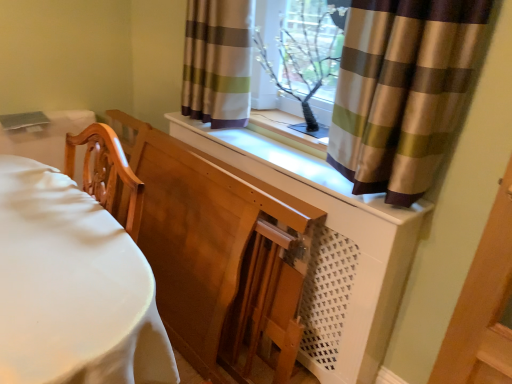
The width and height of the screenshot is (512, 384). What do you see at coordinates (404, 91) in the screenshot?
I see `brown striped curtain at upper center, the second curtain viewed from the back` at bounding box center [404, 91].

This screenshot has height=384, width=512. What do you see at coordinates (217, 62) in the screenshot?
I see `striped fabric curtain at upper center, which is counted as the 2th curtain, starting from the right` at bounding box center [217, 62].

Where is `clear glass window frame at upper center`? Image resolution: width=512 pixels, height=384 pixels. clear glass window frame at upper center is located at coordinates (306, 52).

Considering the relative sizes of clear glass window frame at upper center and brown striped curtain at upper center, which is the 1th curtain from right to left, in the image provided, is clear glass window frame at upper center shorter than brown striped curtain at upper center, which is the 1th curtain from right to left,?

Correct, clear glass window frame at upper center is not as tall as brown striped curtain at upper center, which is the 1th curtain from right to left.

Is there a large distance between clear glass window frame at upper center and brown striped curtain at upper center, the first curtain positioned from the front?

clear glass window frame at upper center is actually quite close to brown striped curtain at upper center, the first curtain positioned from the front.

Is point (289, 39) closer or farther from the camera than point (408, 106)?

Point (289, 39) is positioned farther from the camera compared to point (408, 106).

In the scene shown: Considering the relative sizes of clear glass window frame at upper center and brown striped curtain at upper center, which ranks as the second curtain in left-to-right order, in the image provided, is clear glass window frame at upper center thinner than brown striped curtain at upper center, which ranks as the second curtain in left-to-right order,?

Yes.

Considering the relative sizes of brown striped curtain at upper center, the first curtain positioned from the front, and wooden chair at left in the image provided, is brown striped curtain at upper center, the first curtain positioned from the front, taller than wooden chair at left?

No.

Which is in front, brown striped curtain at upper center, which is the 1th curtain from right to left, or wooden chair at left?

wooden chair at left is more forward.

In order to click on furniture below the brown striped curtain at upper center, the second curtain viewed from the back (from the image's perspective) in this screenshot , I will do `click(72, 287)`.

From a real-world perspective, between striped fabric curtain at upper center, placed as the 1th curtain when sorted from back to front, and brown striped curtain at upper center, the second curtain viewed from the back, who is vertically lower?

From a 3D spatial view, striped fabric curtain at upper center, placed as the 1th curtain when sorted from back to front, is below.

Is point (249, 19) positioned after point (391, 204)?

Yes, point (249, 19) is behind point (391, 204).

Considering the positions of objects striped fabric curtain at upper center, which is counted as the 2th curtain, starting from the right, and brown striped curtain at upper center, the first curtain positioned from the front, in the image provided, who is in front, striped fabric curtain at upper center, which is counted as the 2th curtain, starting from the right, or brown striped curtain at upper center, the first curtain positioned from the front,?

brown striped curtain at upper center, the first curtain positioned from the front, is in front.

In the image, is striped fabric curtain at upper center, placed as the 1th curtain when sorted from back to front, on the left side or the right side of brown striped curtain at upper center, which ranks as the second curtain in left-to-right order?

Clearly, striped fabric curtain at upper center, placed as the 1th curtain when sorted from back to front, is on the left of brown striped curtain at upper center, which ranks as the second curtain in left-to-right order, in the image.

Is wooden chair at left not close to brown striped curtain at upper center, which is the 1th curtain from right to left?

wooden chair at left is actually quite close to brown striped curtain at upper center, which is the 1th curtain from right to left.

Which object is thinner, wooden chair at left or brown striped curtain at upper center, the first curtain positioned from the front?

brown striped curtain at upper center, the first curtain positioned from the front, is thinner.

Is brown striped curtain at upper center, the second curtain viewed from the back, a part of wooden chair at left?

Definitely not — brown striped curtain at upper center, the second curtain viewed from the back, is not inside wooden chair at left.

Which object is positioned more to the left, wooden chair at left or brown striped curtain at upper center, the second curtain viewed from the back?

From the viewer's perspective, wooden chair at left appears more on the left side.

Which of these two, wooden chair at left or clear glass window frame at upper center, is wider?

With larger width is wooden chair at left.

In the image, is wooden chair at left on the left side or the right side of clear glass window frame at upper center?

wooden chair at left is to the left of clear glass window frame at upper center.

Consider the image. Between wooden chair at left and clear glass window frame at upper center, which one has larger size?

Answer: With larger size is wooden chair at left.

In the scene shown: Could you tell me if wooden chair at left is turned towards clear glass window frame at upper center?

No, wooden chair at left does not turn towards clear glass window frame at upper center.

Does clear glass window frame at upper center have a greater width compared to wooden chair at left?

No.

Which is in front, clear glass window frame at upper center or wooden chair at left?

wooden chair at left is in front.

Considering the relative positions of clear glass window frame at upper center and wooden chair at left in the image provided, is clear glass window frame at upper center to the left of wooden chair at left from the viewer's perspective?

No.

In the scene shown: How distant is clear glass window frame at upper center from wooden chair at left?

clear glass window frame at upper center and wooden chair at left are 3.38 feet apart from each other.

Is point (201, 1) behind point (320, 268)?

Yes.

Is striped fabric curtain at upper center, which is counted as the 2th curtain, starting from the right, positioned in front of white matte dresser at center?

No, striped fabric curtain at upper center, which is counted as the 2th curtain, starting from the right, is further to the viewer.

Between striped fabric curtain at upper center, the first curtain positioned from the left, and white matte dresser at center, which one has larger width?

With larger width is white matte dresser at center.

Considering the relative sizes of striped fabric curtain at upper center, the first curtain positioned from the left, and white matte dresser at center in the image provided, is striped fabric curtain at upper center, the first curtain positioned from the left, bigger than white matte dresser at center?

No, striped fabric curtain at upper center, the first curtain positioned from the left, is not bigger than white matte dresser at center.

Image resolution: width=512 pixels, height=384 pixels. In order to click on curtain that is on the right side of clear glass window frame at upper center in this screenshot , I will do `click(404, 91)`.

Identify the location of curtain that is the 1st object located above the wooden chair at left (from the image's perspective). The height and width of the screenshot is (384, 512). (404, 91).

From the picture: When comparing their distances from white matte dresser at center, does brown striped curtain at upper center, the first curtain positioned from the front, or striped fabric curtain at upper center, the first curtain positioned from the left, seem further?

striped fabric curtain at upper center, the first curtain positioned from the left, lies further to white matte dresser at center than the other object.

From the image, which object appears to be nearer to wooden chair at left, white matte dresser at center or brown striped curtain at upper center, which ranks as the second curtain in left-to-right order?

white matte dresser at center is closer to wooden chair at left.

Based on their spatial positions, is brown striped curtain at upper center, which ranks as the second curtain in left-to-right order, or striped fabric curtain at upper center, arranged as the 2th curtain when viewed from the front, closer to wooden chair at left?

The object closer to wooden chair at left is striped fabric curtain at upper center, arranged as the 2th curtain when viewed from the front.

Based on their spatial positions, is white matte dresser at center or wooden chair at left further from brown striped curtain at upper center, the first curtain positioned from the front?

wooden chair at left.

Looking at this image, considering their positions, is wooden chair at left positioned closer to white matte dresser at center than brown striped curtain at upper center, the second curtain viewed from the back?

The object closer to white matte dresser at center is brown striped curtain at upper center, the second curtain viewed from the back.

When comparing their distances from brown striped curtain at upper center, which is the 1th curtain from right to left, does striped fabric curtain at upper center, placed as the 1th curtain when sorted from back to front, or wooden chair at left seem closer?

Based on the image, striped fabric curtain at upper center, placed as the 1th curtain when sorted from back to front, appears to be nearer to brown striped curtain at upper center, which is the 1th curtain from right to left.

Estimate the real-world distances between objects in this image. Which object is further from striped fabric curtain at upper center, placed as the 1th curtain when sorted from back to front, white matte dresser at center or brown striped curtain at upper center, the first curtain positioned from the front?

brown striped curtain at upper center, the first curtain positioned from the front, is positioned further to the anchor striped fabric curtain at upper center, placed as the 1th curtain when sorted from back to front.

From the image, which object appears to be farther from white matte dresser at center, wooden chair at left or clear glass window frame at upper center?

wooden chair at left.

Locate an element on the screen. furniture between striped fabric curtain at upper center, which is counted as the 2th curtain, starting from the right, and white matte dresser at center from top to bottom is located at coordinates (72, 287).

Locate an element on the screen. curtain between wooden chair at left and clear glass window frame at upper center from left to right is located at coordinates (217, 62).

Identify the location of curtain between clear glass window frame at upper center and white matte dresser at center vertically. (404, 91).

Locate an element on the screen. Image resolution: width=512 pixels, height=384 pixels. curtain situated between wooden chair at left and brown striped curtain at upper center, the first curtain positioned from the front, from left to right is located at coordinates (217, 62).